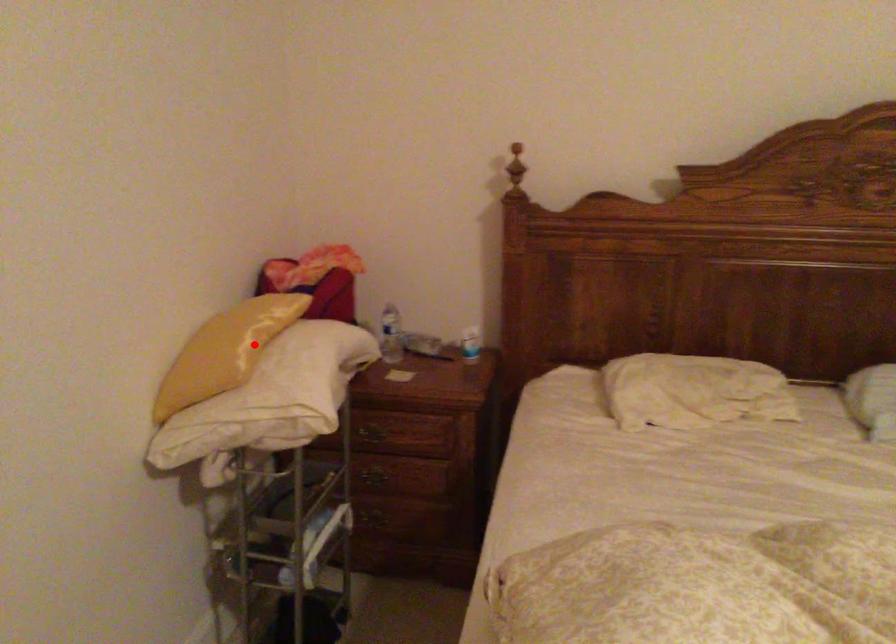
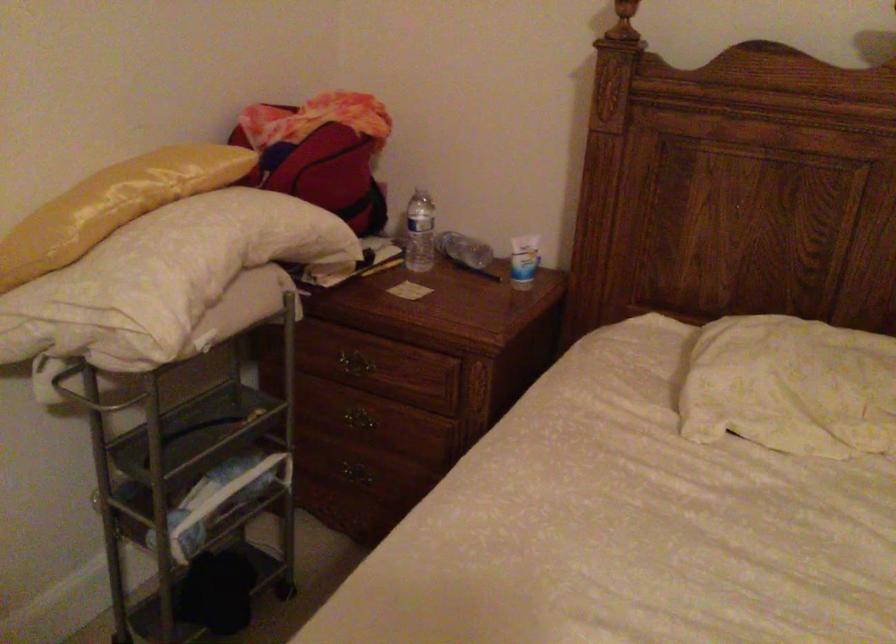
In the second image, find the point that corresponds to the highlighted location in the first image.

(113, 205)